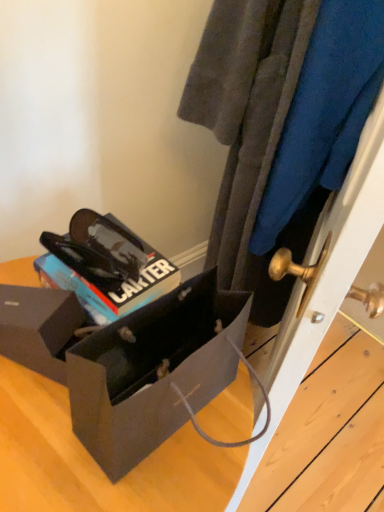
Identify the location of space that is in front of matte black box at lower left, which is counted as the first box, starting from the back. [x=33, y=442].